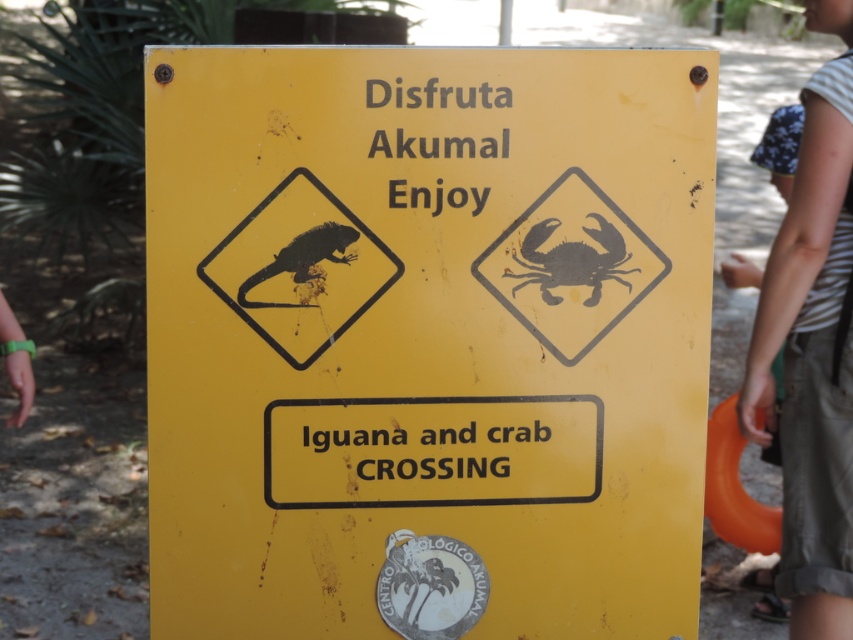
Question: Does striped fabric shirt at upper right appear over black matte crab at upper right?

Choices:
 (A) yes
 (B) no

Answer: (B)

Question: Is black matte crab at upper right to the left of matte black iguana at upper left from the viewer's perspective?

Choices:
 (A) no
 (B) yes

Answer: (A)

Question: Can you confirm if yellow matte sign at center is positioned above black matte crab at upper right?

Choices:
 (A) yes
 (B) no

Answer: (B)

Question: Which object appears closest to the camera in this image?

Choices:
 (A) black matte crab at upper right
 (B) matte black iguana at upper left

Answer: (B)

Question: Which point is farther to the camera?

Choices:
 (A) black matte crab at upper right
 (B) yellow matte sign at center

Answer: (A)

Question: Which is nearer to the striped fabric shirt at upper right?

Choices:
 (A) matte black iguana at upper left
 (B) yellow matte sign at center

Answer: (B)